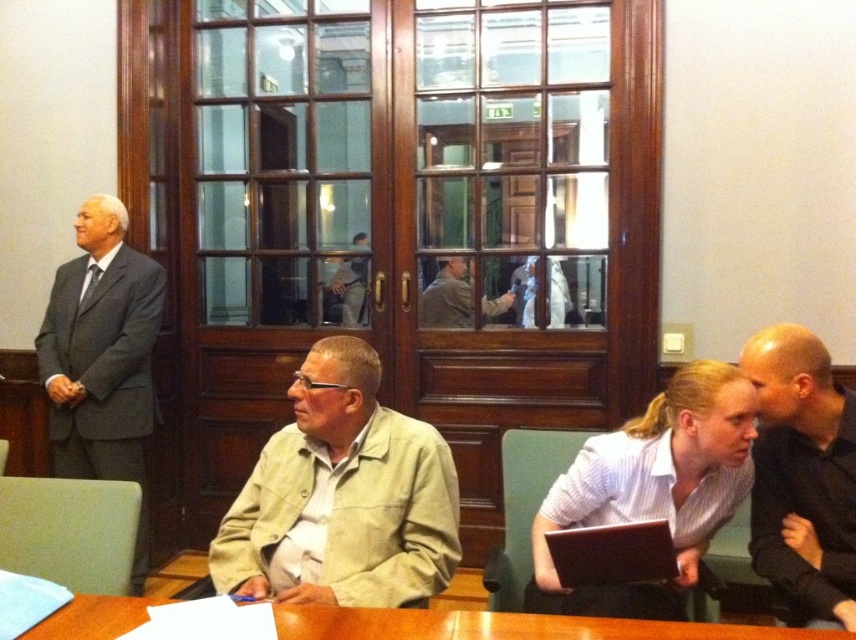
You are standing in the meeting room and want to place a 5 feet long banner on the floor in front of the brown wooden table at lower center. Is there enough space between you and the table to lay it out fully?

The brown wooden table at lower center is 4.65 feet away from the camera. Since the banner is 5 feet long, the distance is insufficient. You would need at least 5 feet of space to lay it out fully, so it won not fit.

You are a photographer trying to capture a candid shot of the black matte shirt at right and the brown wooden table at lower center. Since you want to include both in the frame, which object should you position closer to the edge of the camera frame to ensure both are visible?

You should position the black matte shirt at right closer to the edge of the camera frame since it is on the right side of the brown wooden table at lower center, allowing both to fit within the shot.